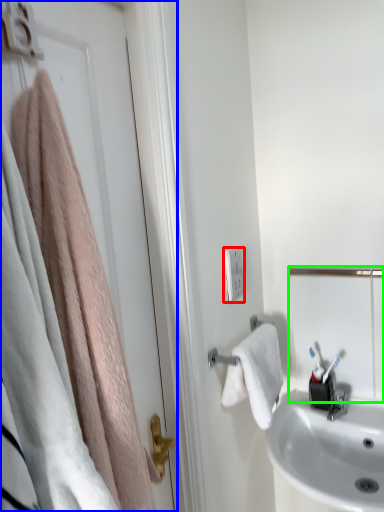
Question: Estimate the real-world distances between objects in this image. Which object is closer to light switch (highlighted by a red box), door (highlighted by a blue box) or mirror (highlighted by a green box)?

Choices:
 (A) door
 (B) mirror

Answer: (B)